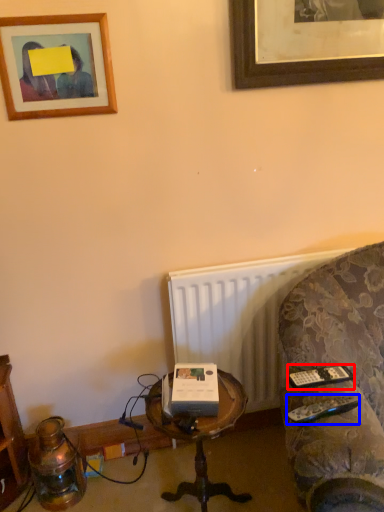
Question: Which of the following is the closest to the observer, remote (highlighted by a red box) or remote (highlighted by a blue box)?

Choices:
 (A) remote
 (B) remote

Answer: (B)